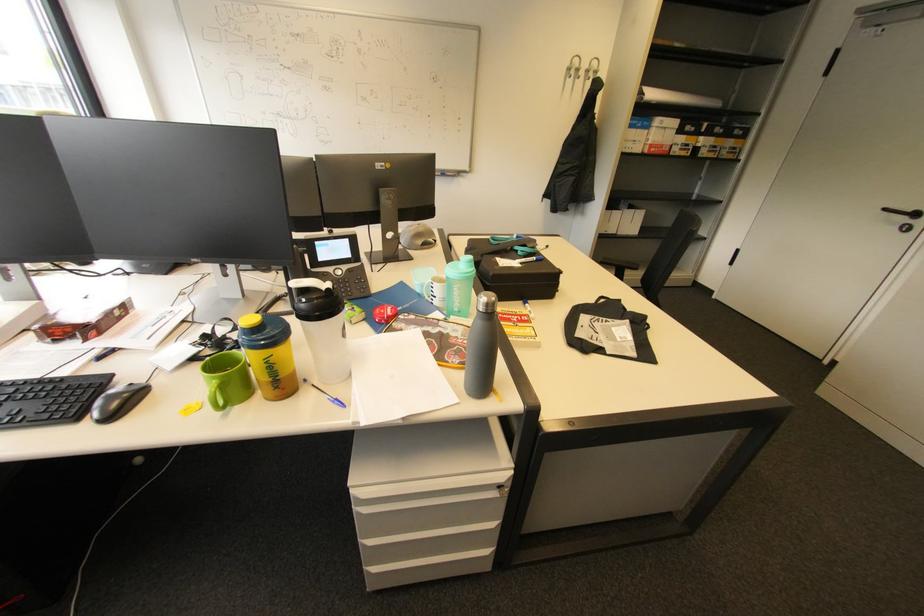
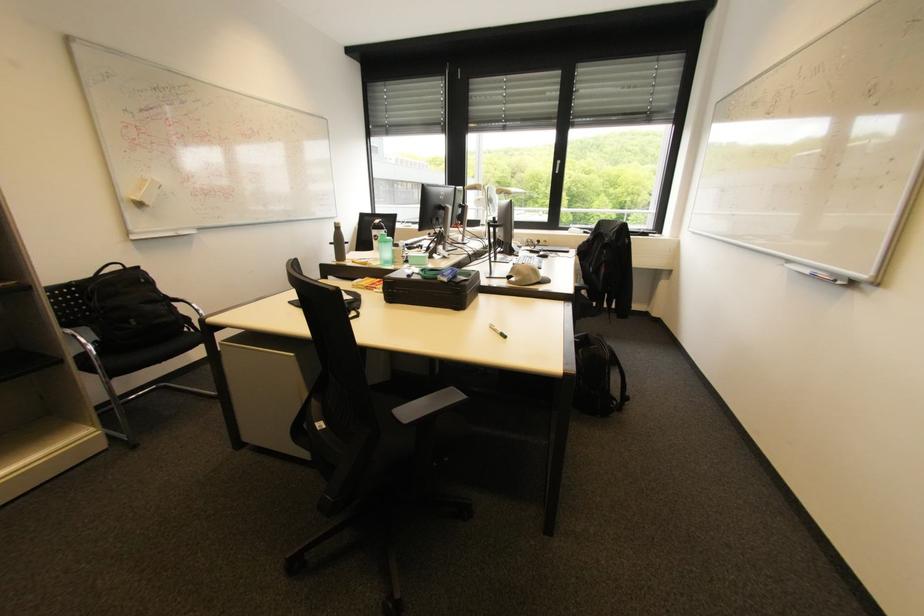
The point at (x=546, y=249) is marked in the first image. Where is the corresponding point in the second image?

(501, 329)